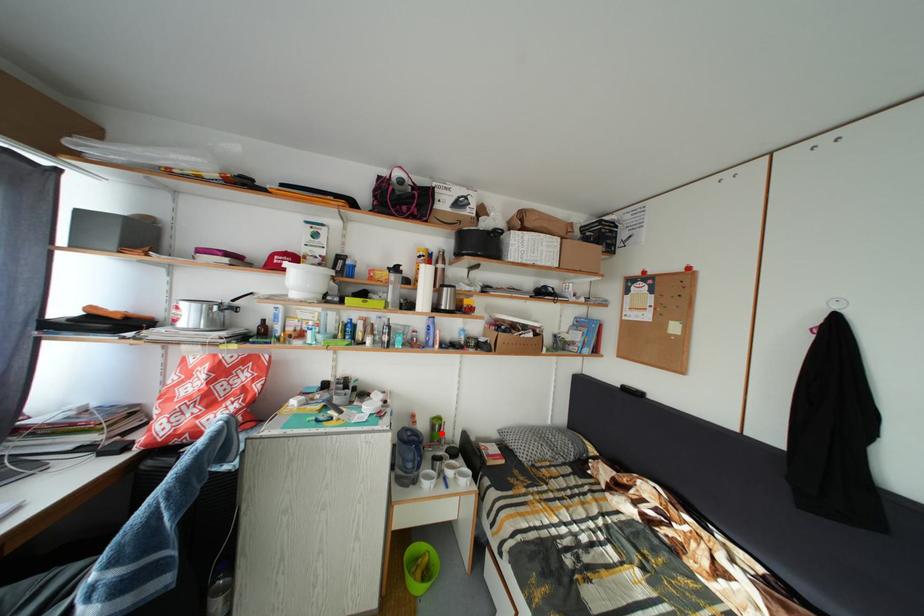
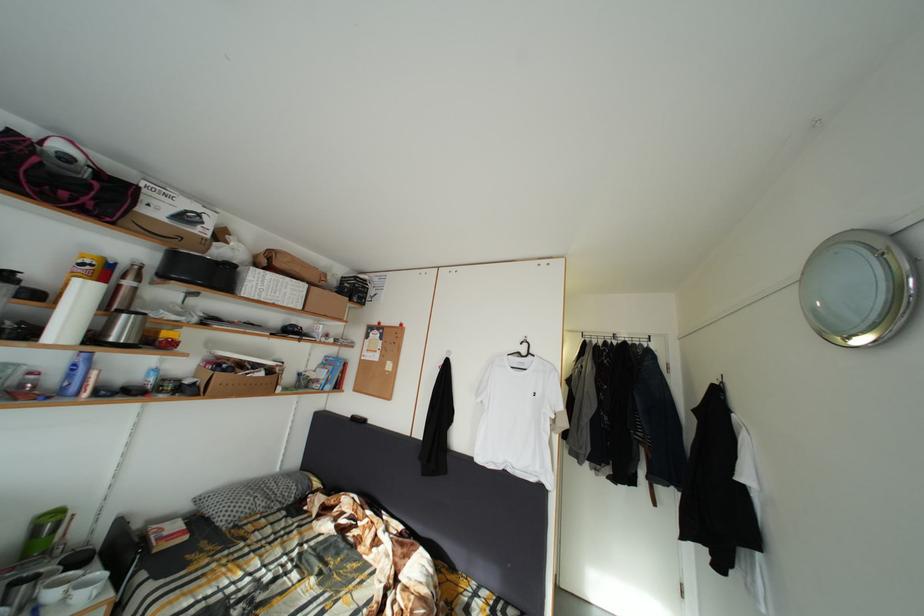
Question: I am providing you with two images of the same scene from different viewpoints. Image1 has a red point marked. In image2, the corresponding 3D location appears at what relative position? Reply with the corresponding letter.

Choices:
 (A) Closer
 (B) Farther

Answer: (A)